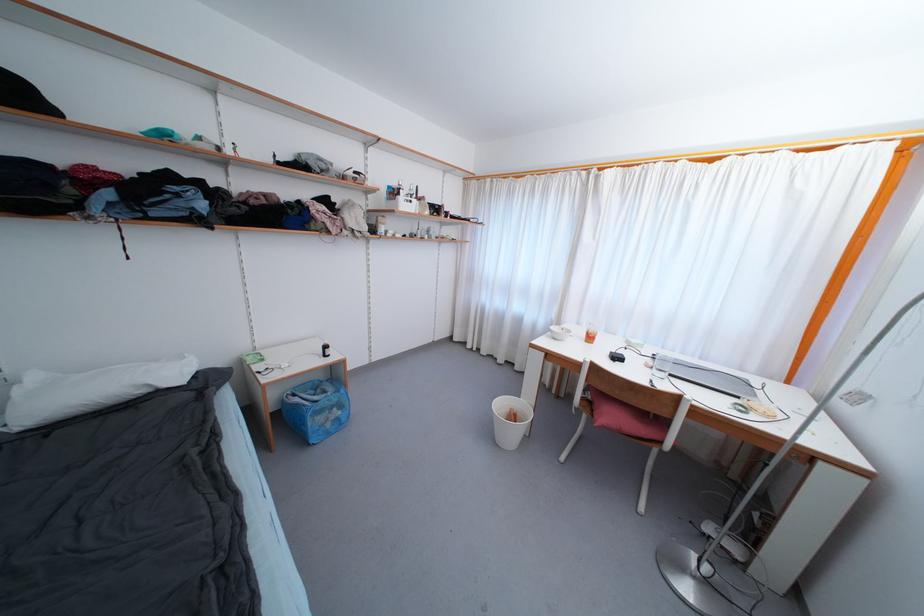
Where would you sit the pink chair sitting surface? Please return your answer as a coordinate pair (x, y).

(621, 419)